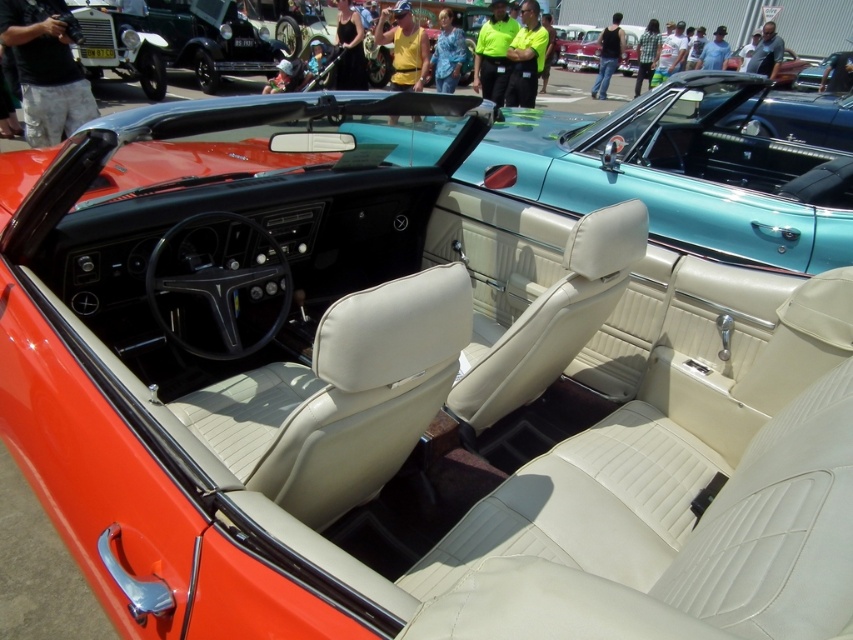
You are a photographer at a car exhibition and need to position two matte black cars for a photo shoot. You have the matte black car at upper left and the matte black convertible at upper center. Based on their sizes, which car should you place closer to the camera to ensure they appear similar in size in the final photo?

The matte black convertible at upper center should be placed closer to the camera since it is narrower than the matte black car at upper left. By positioning the smaller car closer, they will appear more balanced in size in the photo.